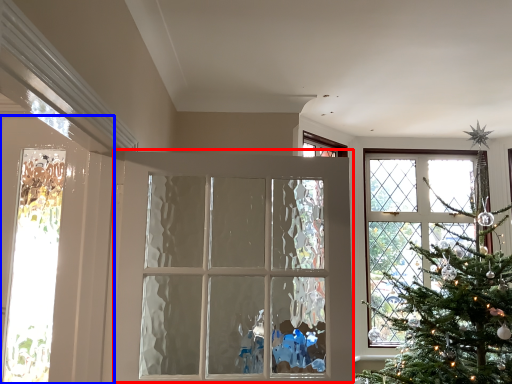
Question: Which object appears farthest to the camera in this image, door (highlighted by a red box) or door (highlighted by a blue box)?

Choices:
 (A) door
 (B) door

Answer: (B)